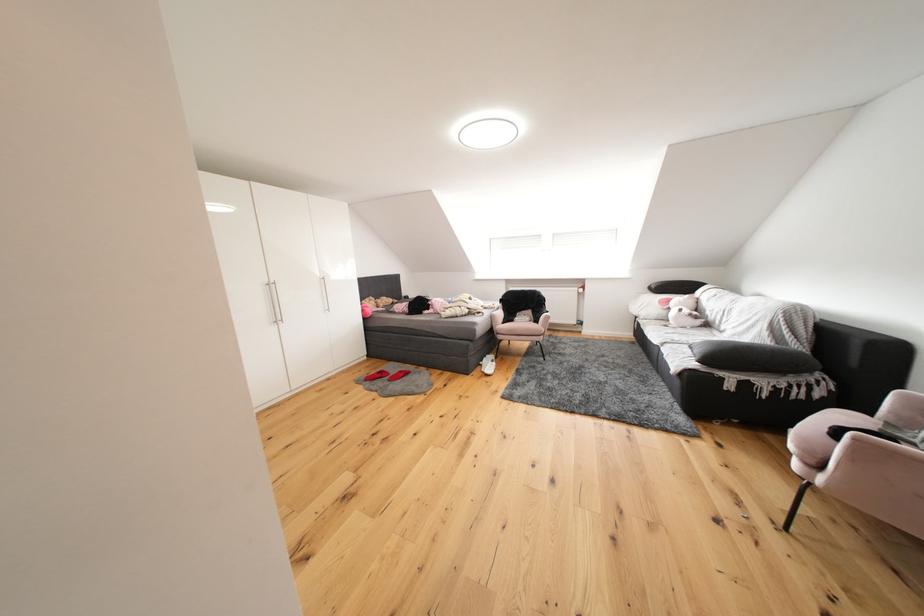
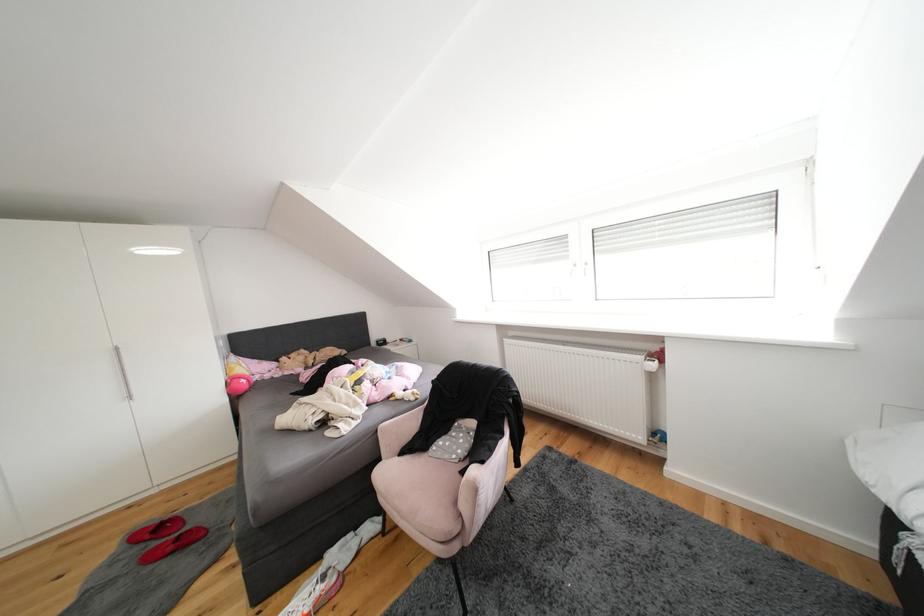
The point at (586,293) is marked in the first image. Where is the corresponding point in the second image?

(650, 362)